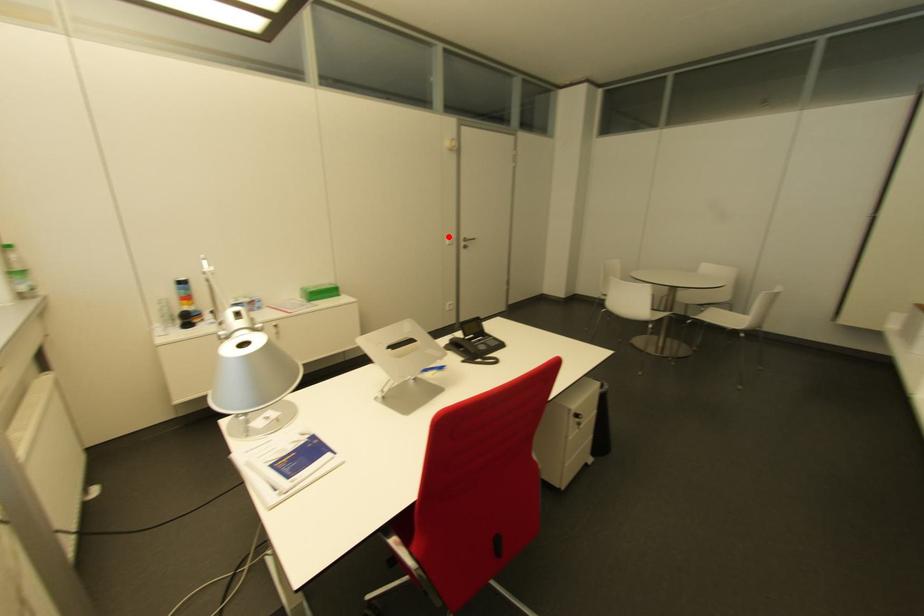
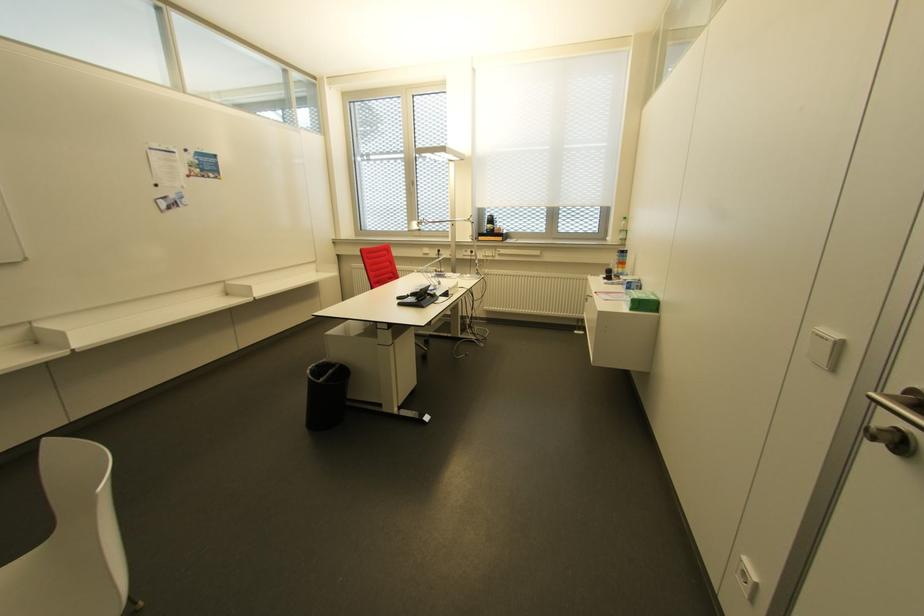
Locate, in the second image, the point that corresponds to the highlighted location in the first image.

(833, 334)